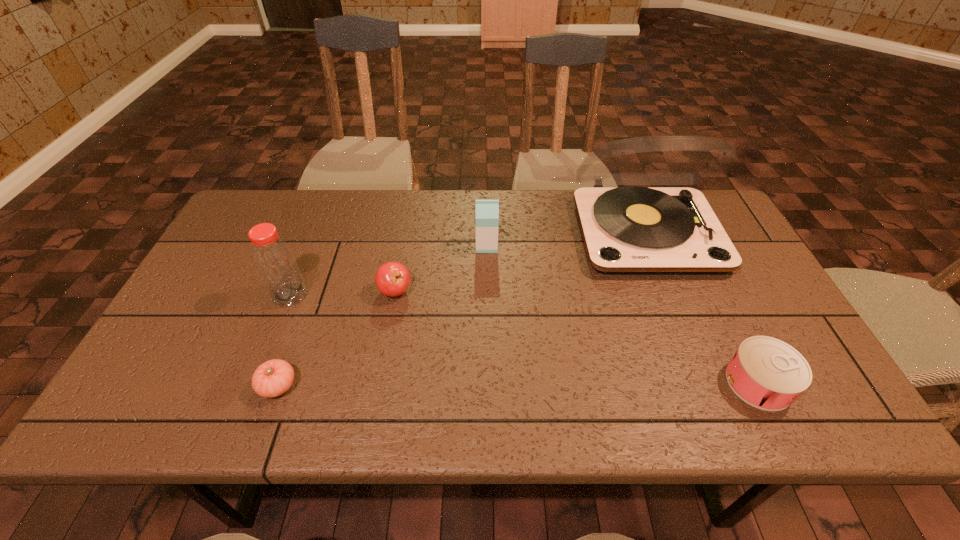
This screenshot has width=960, height=540. I want to click on vacant area between the fifth tallest object and the shortest object, so click(518, 384).

Identify the location of vacant region between the third object from left to right and the fifth shortest object. (343, 293).

This screenshot has width=960, height=540. I want to click on blank region between the apple and the fourth shortest object, so click(x=441, y=268).

Find the location of a particular element. vacant area between the record player and the fourth object from left to right is located at coordinates (566, 239).

Point out which object is positioned as the nearest to the can. Please provide its 2D coordinates. Your answer should be formatted as a tuple, i.e. [(x, y)], where the tuple contains the x and y coordinates of a point satisfying the conditions above.

[(627, 230)]

Identify which object is the third nearest to the second tallest object. Please provide its 2D coordinates. Your answer should be formatted as a tuple, i.e. [(x, y)], where the tuple contains the x and y coordinates of a point satisfying the conditions above.

[(487, 211)]

The height and width of the screenshot is (540, 960). What are the coordinates of `blank space that satisfies the following two spatial constraints: 1. on the back side of the fourth shortest object; 2. on the left side of the bottle` in the screenshot? It's located at (310, 246).

The width and height of the screenshot is (960, 540). I want to click on free space that satisfies the following two spatial constraints: 1. on the front side of the bottle; 2. on the right side of the tomato, so click(253, 386).